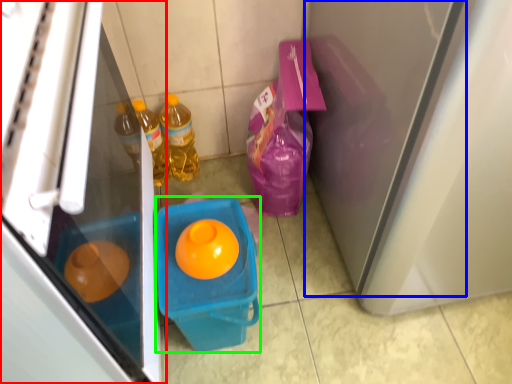
Question: Which object is positioned farthest from refrigerator (highlighted by a red box)? Select from screen door (highlighted by a blue box) and recycling bin (highlighted by a green box).

Choices:
 (A) screen door
 (B) recycling bin

Answer: (A)